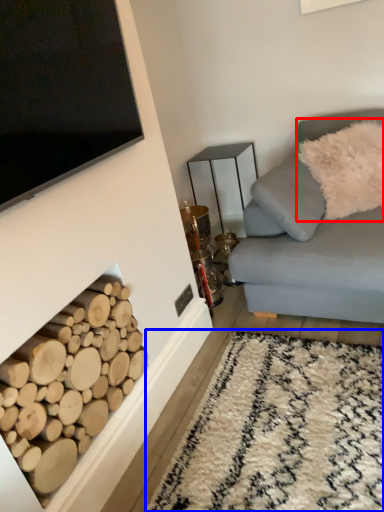
Question: Which point is further to the camera, pillow (highlighted by a red box) or plain (highlighted by a blue box)?

Choices:
 (A) pillow
 (B) plain

Answer: (A)